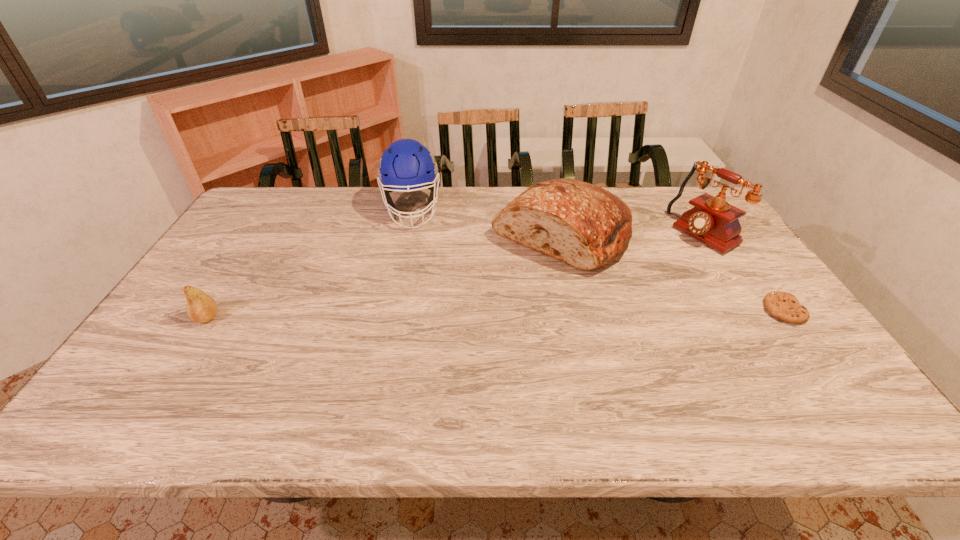
Identify the location of vacant space on the desktop that is between the pear and the cookie and is positioned at the sliced front of the bread. Image resolution: width=960 pixels, height=540 pixels. (457, 314).

Locate an element on the screen. The height and width of the screenshot is (540, 960). vacant space on the desktop that is between the fourth tallest object and the shortest object and is positioned on the face guard of the football helmet is located at coordinates (416, 315).

In order to click on free space on the desktop that is between the leftmost object and the cookie and is positioned on the dial of the telephone in this screenshot , I will do point(557,313).